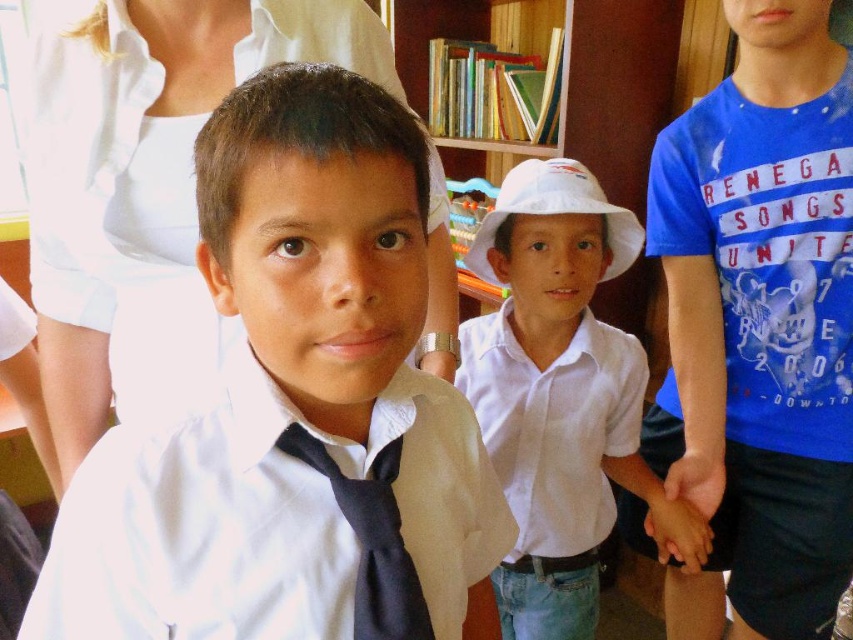
Which is behind, point (526, 609) or point (408, 618)?

The point (526, 609) is behind.

Does white cotton shirt at center have a lesser width compared to black satin tie at center?

No, white cotton shirt at center is not thinner than black satin tie at center.

This screenshot has height=640, width=853. In order to click on white cotton shirt at center in this screenshot , I will do `click(560, 394)`.

Between white matte shirt at center and white cotton shirt at center, which one has less height?

Standing shorter between the two is white matte shirt at center.

Measure the distance between point (430, 385) and camera.

Point (430, 385) is 25.50 inches away from camera.

At what (x,y) coordinates should I click in order to perform the action: click on white matte shirt at center. Please return your answer as a coordinate pair (x, y). Image resolution: width=853 pixels, height=640 pixels. Looking at the image, I should click on (293, 408).

Is blue cotton t-shirt at right shorter than white cotton shirt at center?

No, blue cotton t-shirt at right is not shorter than white cotton shirt at center.

Is blue cotton t-shirt at right wider than white cotton shirt at center?

Incorrect, blue cotton t-shirt at right's width does not surpass white cotton shirt at center's.

Image resolution: width=853 pixels, height=640 pixels. I want to click on blue cotton t-shirt at right, so click(x=773, y=337).